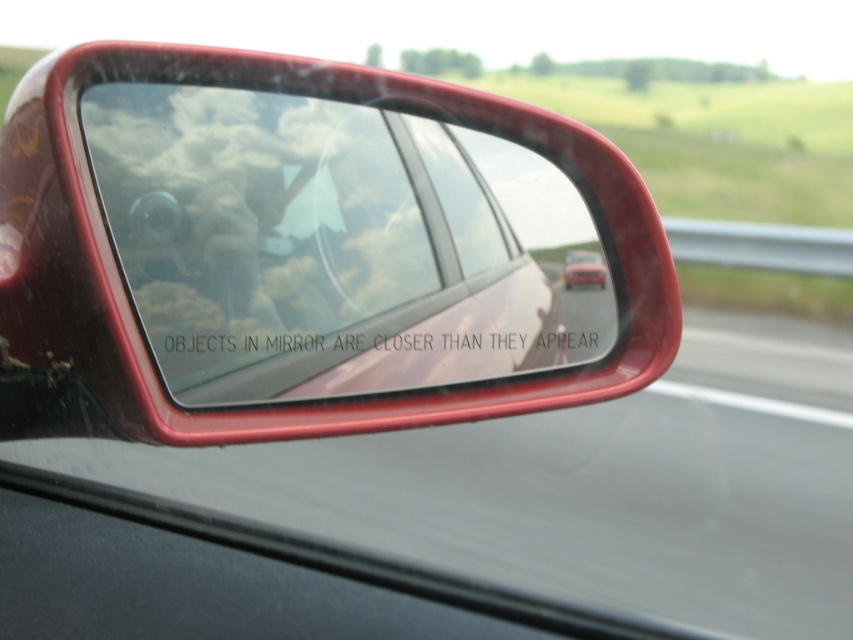
Is transparent glass windshield at center taller than matte red car at center?

→ Yes, transparent glass windshield at center is taller than matte red car at center.

Is transparent glass windshield at center behind matte red car at center?

No, transparent glass windshield at center is closer to the viewer.

Where is `transparent glass windshield at center`? The width and height of the screenshot is (853, 640). transparent glass windshield at center is located at coordinates 334,244.